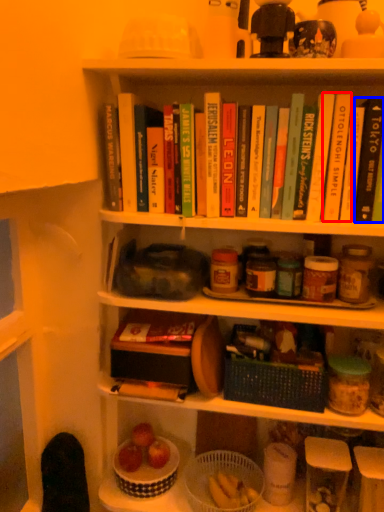
Question: Which point is further to the camera, paperback book (highlighted by a red box) or paperback book (highlighted by a blue box)?

Choices:
 (A) paperback book
 (B) paperback book

Answer: (A)